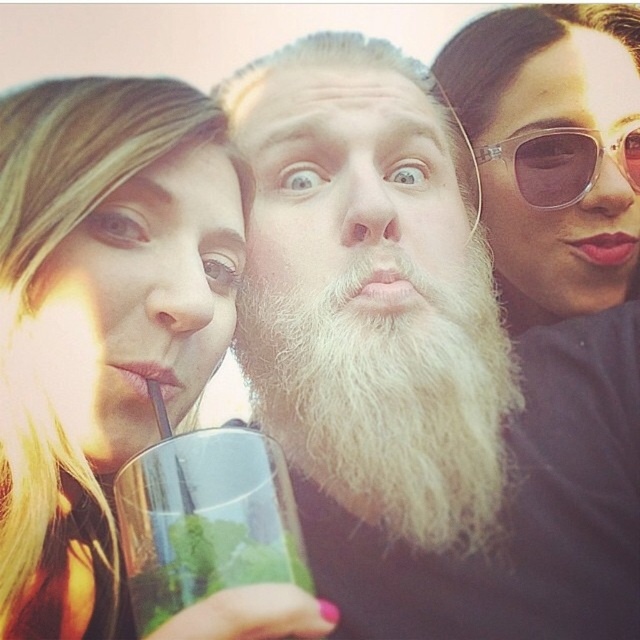
Question: Is white beard at center wider than clear glass at center?

Choices:
 (A) no
 (B) yes

Answer: (B)

Question: Does white beard at center appear on the left side of sunglasses at upper right?

Choices:
 (A) no
 (B) yes

Answer: (B)

Question: Which point is farther to the camera?

Choices:
 (A) (310, 580)
 (B) (547, 307)
 (C) (493, 312)

Answer: (B)

Question: Is white fluffy beard at center to the right of transparent plastic sunglasses at upper right from the viewer's perspective?

Choices:
 (A) yes
 (B) no

Answer: (B)

Question: Which point appears farthest from the camera in this image?

Choices:
 (A) (492, 308)
 (B) (316, 374)

Answer: (A)

Question: Which object is farther from the camera taking this photo?

Choices:
 (A) blonde hair at left
 (B) sunglasses at upper right
 (C) clear glass at center

Answer: (B)